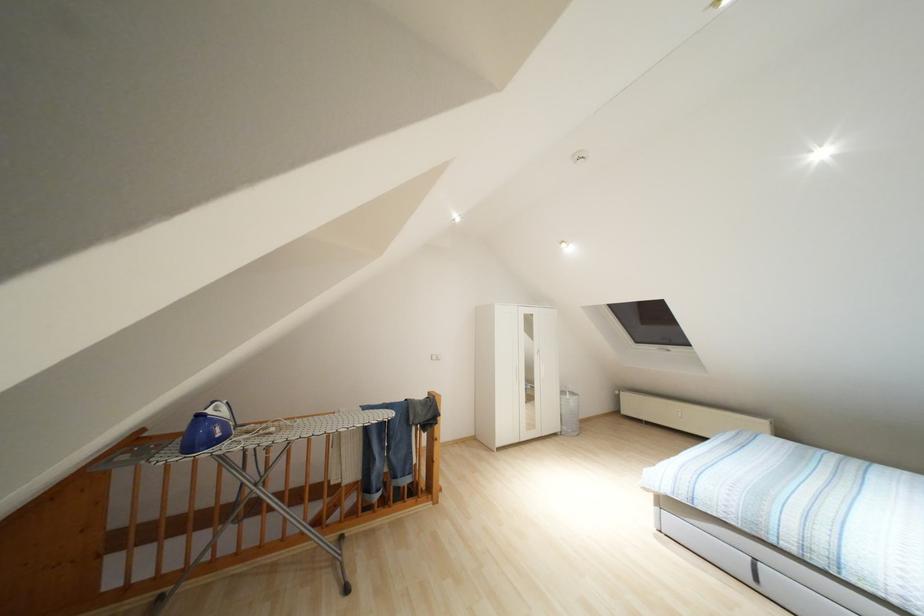
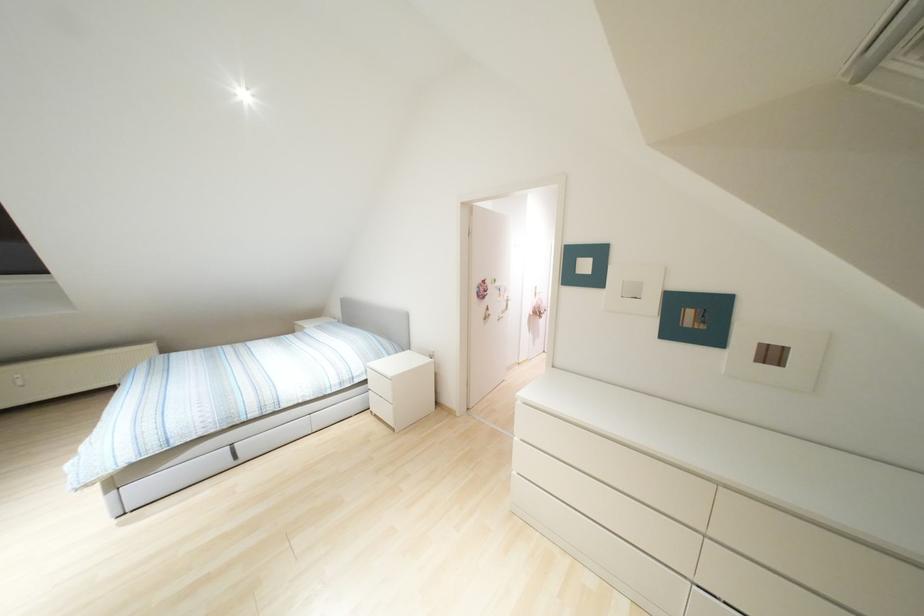
Question: The images are taken continuously from a first-person perspective. In which direction is your viewpoint rotating?

Choices:
 (A) Left
 (B) Right
 (C) Up
 (D) Down

Answer: (B)